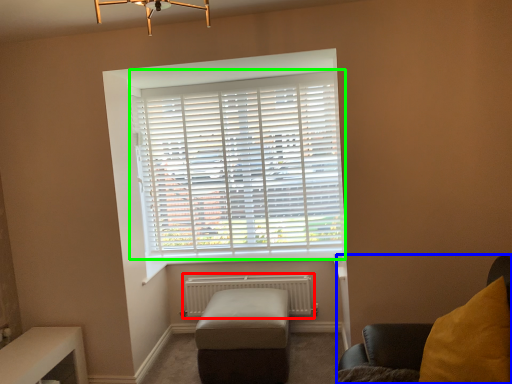
Question: Which object is the closest to the radiator (highlighted by a red box)? Choose among these: furniture (highlighted by a blue box) or window blind (highlighted by a green box).

Choices:
 (A) furniture
 (B) window blind

Answer: (B)